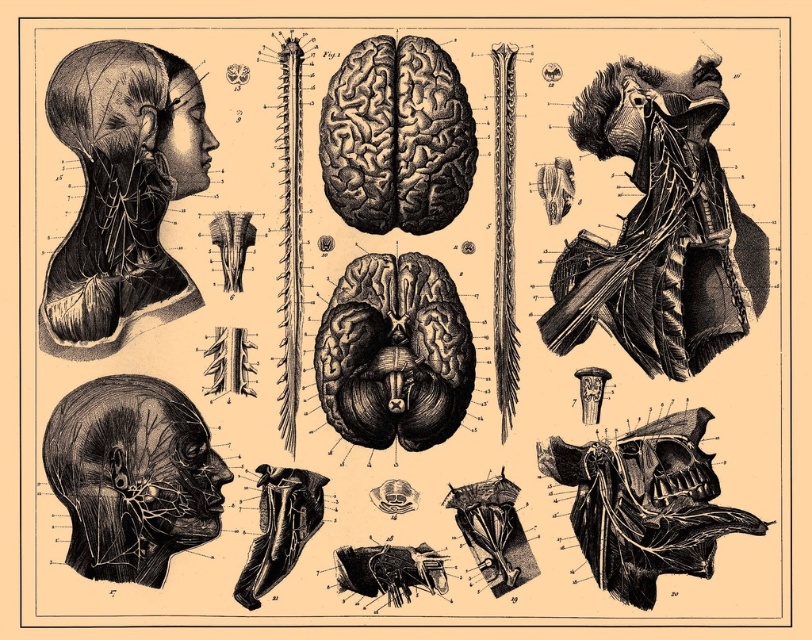
You are a medical student who needs to place a 36 inch ruler between the black textured neck at lower left and the smooth black muscle at upper right. Can the ruler fit entirely between them?

The distance between the black textured neck at lower left and the smooth black muscle at upper right is 38.46 inches, which is longer than the ruler. Therefore, the ruler can fit entirely between them.

You are a medical student analyzing this anatomical illustration. You notice the black engraving brain at center and the matte black head at upper left. Based on their positions, which object is located to the left of the other?

The matte black head at upper left is to the left of the black engraving brain at center.